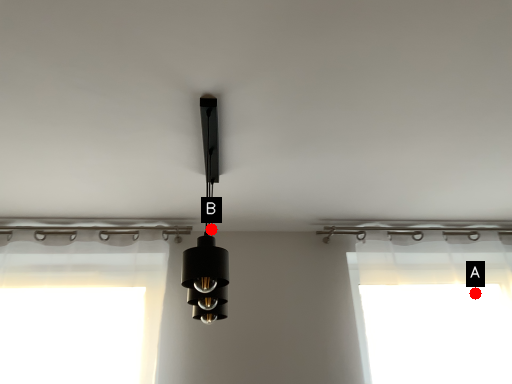
Question: Two points are circled on the image, labeled by A and B beside each circle. Which point appears farthest from the camera in this image?

Choices:
 (A) A is further
 (B) B is further

Answer: (A)